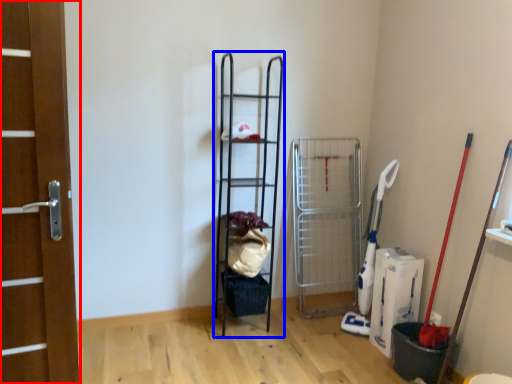
Question: Which point is further to the camera, door (highlighted by a red box) or ladder (highlighted by a blue box)?

Choices:
 (A) door
 (B) ladder

Answer: (B)